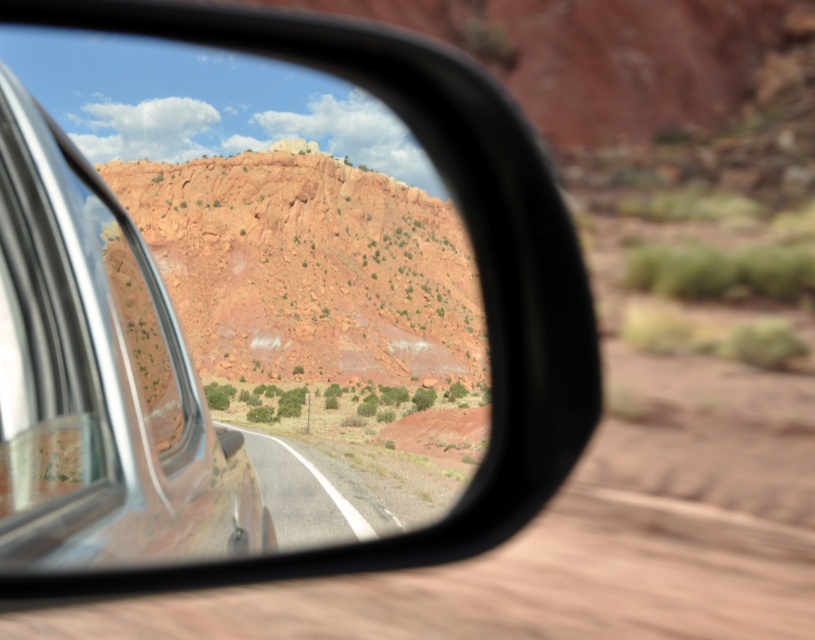
Consider the image. You are driving a car and looking at the side mirror. You see two points reflected in the mirror. The first point is at coordinate point(491, 456) and the second is at point(271, 454). Based on their positions in the mirror, which point is closer to your car?

Point(491, 456) is in front of point(271, 454) in the mirror, so it is closer to the car.

You are driving a car and need to check your side mirror to see the distance between the brushed metal car window at left and the smooth asphalt road at center. According to the reflection in the mirror, how far apart are these two objects?

The brushed metal car window at left is 10.06 meters away from the smooth asphalt road at center according to the mirror reflection.

You are driving a car and want to check the road ahead through your side mirror. Which object, the brushed metal car window at left or the smooth asphalt road at center, will appear narrower in the reflection?

The brushed metal car window at left has a lesser width compared to the smooth asphalt road at center, so it will appear narrower in the reflection.